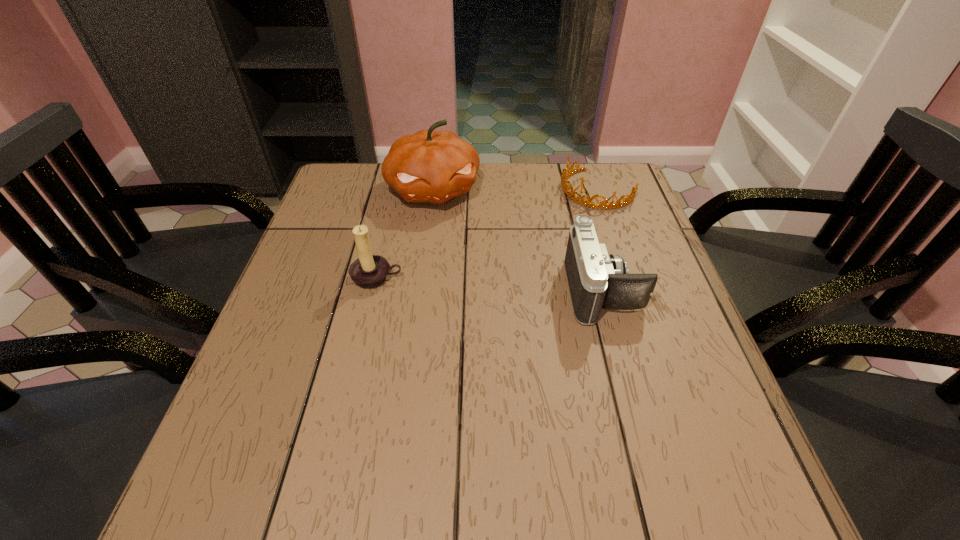
This screenshot has height=540, width=960. What are the coordinates of `free spot located 0.300m on the front face of the tallest object` in the screenshot? It's located at (470, 295).

In order to click on tiara that is at the far edge in this screenshot , I will do `click(629, 198)`.

This screenshot has height=540, width=960. Identify the location of pumpkin that is at the far edge. (429, 166).

This screenshot has height=540, width=960. What are the coordinates of `object that is at the left edge` in the screenshot? It's located at (369, 271).

Find the location of `camera located at the right edge`. camera located at the right edge is located at coordinates (596, 279).

Identify the location of tiara at the right edge. (629, 198).

Where is `object present at the far right corner`? object present at the far right corner is located at coordinates (629, 198).

At what (x,y) coordinates should I click in order to perform the action: click on blank space at the far edge of the desktop. Please return your answer as a coordinate pair (x, y). This screenshot has width=960, height=540. Looking at the image, I should click on (533, 201).

In order to click on vacant space at the near edge in this screenshot , I will do `click(521, 446)`.

Where is `vacant space at the left edge`? The image size is (960, 540). vacant space at the left edge is located at coordinates (341, 253).